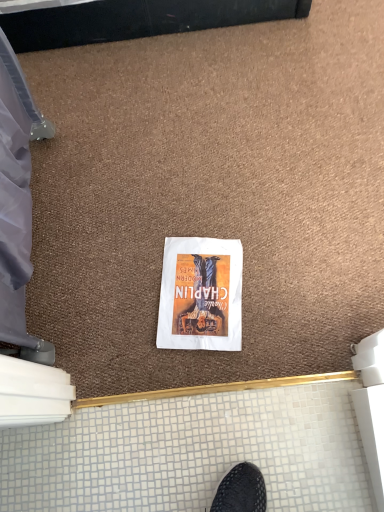
What are the coordinates of `vacant space situated above matte paper poster at center (from a real-world perspective)` in the screenshot? It's located at (201, 290).